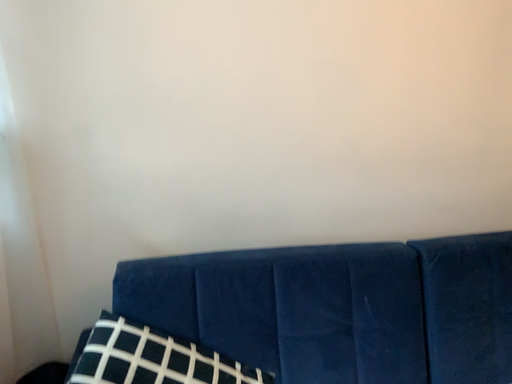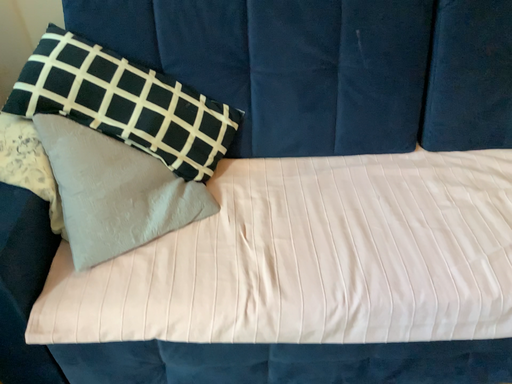
Question: How did the camera likely rotate when shooting the video?

Choices:
 (A) rotated upward
 (B) rotated downward

Answer: (B)